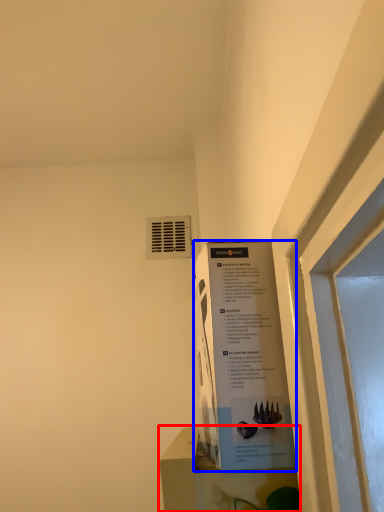
Question: Which object appears farthest to the camera in this image, window sill (highlighted by a red box) or poster (highlighted by a blue box)?

Choices:
 (A) window sill
 (B) poster

Answer: (B)